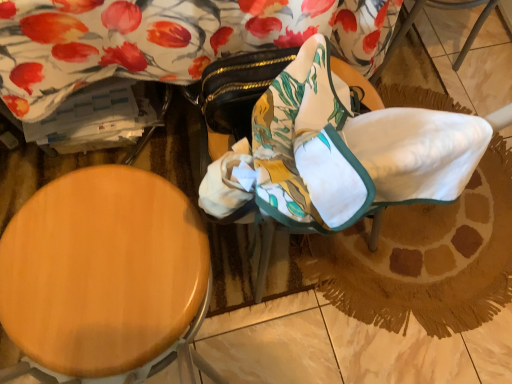
Question: From the image's perspective, is wooden stool at left under floral fabric swivel chair at center?

Choices:
 (A) no
 (B) yes

Answer: (B)

Question: Does wooden stool at left have a greater width compared to floral fabric swivel chair at center?

Choices:
 (A) yes
 (B) no

Answer: (A)

Question: Is wooden stool at left in front of floral fabric swivel chair at center?

Choices:
 (A) no
 (B) yes

Answer: (B)

Question: From a real-world perspective, does wooden stool at left stand above floral fabric swivel chair at center?

Choices:
 (A) yes
 (B) no

Answer: (B)

Question: Is wooden stool at left oriented away from floral fabric swivel chair at center?

Choices:
 (A) yes
 (B) no

Answer: (B)

Question: Does wooden stool at left have a greater height compared to floral fabric swivel chair at center?

Choices:
 (A) yes
 (B) no

Answer: (A)

Question: Considering the relative sizes of floral fabric swivel chair at center and wooden stool at left in the image provided, is floral fabric swivel chair at center thinner than wooden stool at left?

Choices:
 (A) yes
 (B) no

Answer: (A)

Question: Is the depth of floral fabric swivel chair at center less than that of wooden stool at left?

Choices:
 (A) no
 (B) yes

Answer: (A)

Question: Is floral fabric swivel chair at center next to wooden stool at left and touching it?

Choices:
 (A) no
 (B) yes

Answer: (A)

Question: Is floral fabric swivel chair at center to the left of wooden stool at left from the viewer's perspective?

Choices:
 (A) yes
 (B) no

Answer: (B)

Question: Does floral fabric swivel chair at center have a lesser height compared to wooden stool at left?

Choices:
 (A) no
 (B) yes

Answer: (B)

Question: Could you tell me if floral fabric swivel chair at center is facing wooden stool at left?

Choices:
 (A) yes
 (B) no

Answer: (B)

Question: From the image's perspective, is wooden stool at left positioned above or below floral fabric swivel chair at center?

Choices:
 (A) below
 (B) above

Answer: (A)